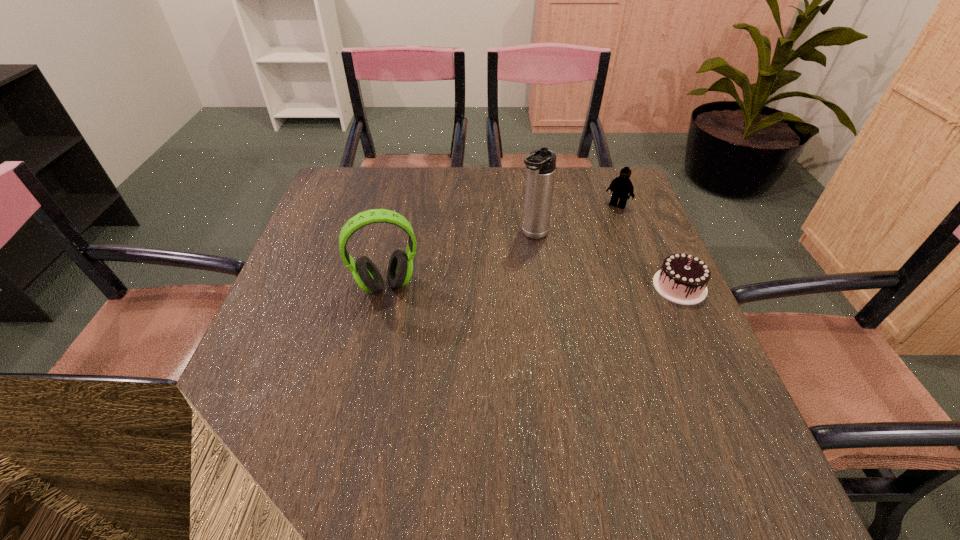
Locate an element on the screen. The width and height of the screenshot is (960, 540). blank region between the headset and the chocolate cake is located at coordinates (533, 286).

The width and height of the screenshot is (960, 540). Find the location of `vacant space in between the third nearest object and the chocolate cake`. vacant space in between the third nearest object and the chocolate cake is located at coordinates (607, 261).

This screenshot has height=540, width=960. Identify the location of free spot between the shortest object and the headset. (533, 286).

Identify the location of vacant region between the third object from right to left and the headset. (460, 260).

Where is `free space between the shortest object and the tallest object`? free space between the shortest object and the tallest object is located at coordinates (607, 261).

Find the location of a particular element. The image size is (960, 540). vacant point located between the leftmost object and the chocolate cake is located at coordinates (533, 286).

The height and width of the screenshot is (540, 960). I want to click on object that is the nearest to the chocolate cake, so click(541, 163).

Where is `object that is the closest to the chocolate cake`? The height and width of the screenshot is (540, 960). object that is the closest to the chocolate cake is located at coordinates (541, 163).

Find the location of a particular element. This screenshot has width=960, height=540. free point that satisfies the following two spatial constraints: 1. on the back side of the third nearest object; 2. on the right side of the second shortest object is located at coordinates (529, 205).

Where is `vacant region that satisfies the following two spatial constraints: 1. on the front side of the tallest object; 2. on the left side of the shortest object`? The width and height of the screenshot is (960, 540). vacant region that satisfies the following two spatial constraints: 1. on the front side of the tallest object; 2. on the left side of the shortest object is located at coordinates (540, 286).